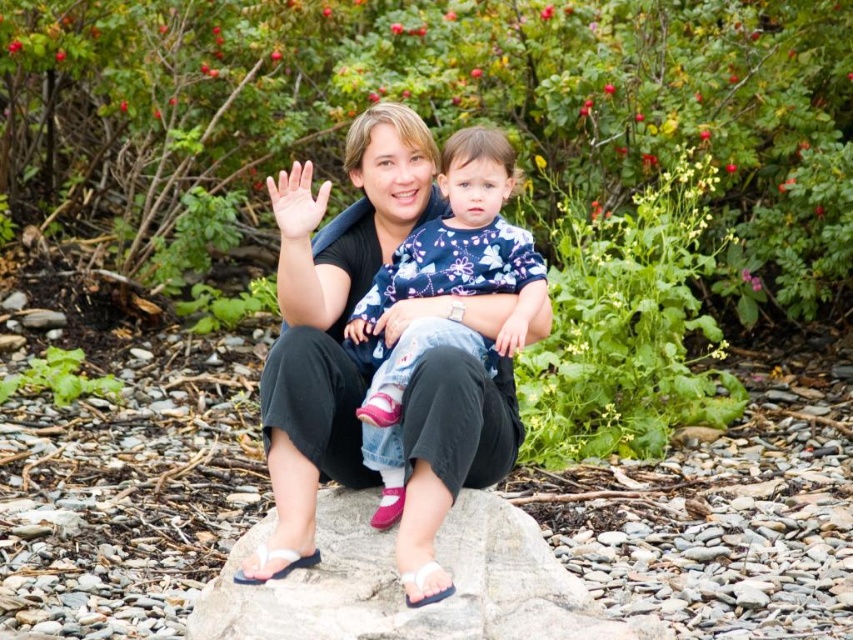
Question: Which object is closer to the camera taking this photo?

Choices:
 (A) gray smooth rock at center
 (B) floral-patterned fabric at center

Answer: (A)

Question: Among these objects, which one is nearest to the camera?

Choices:
 (A) gray smooth rock at center
 (B) floral-patterned fabric at center

Answer: (A)

Question: Is gray smooth rock at center below floral-patterned fabric at center?

Choices:
 (A) yes
 (B) no

Answer: (A)

Question: Does gray smooth rock at center lie behind floral-patterned fabric at center?

Choices:
 (A) no
 (B) yes

Answer: (A)

Question: Does gray smooth rock at center appear on the right side of floral-patterned fabric at center?

Choices:
 (A) no
 (B) yes

Answer: (B)